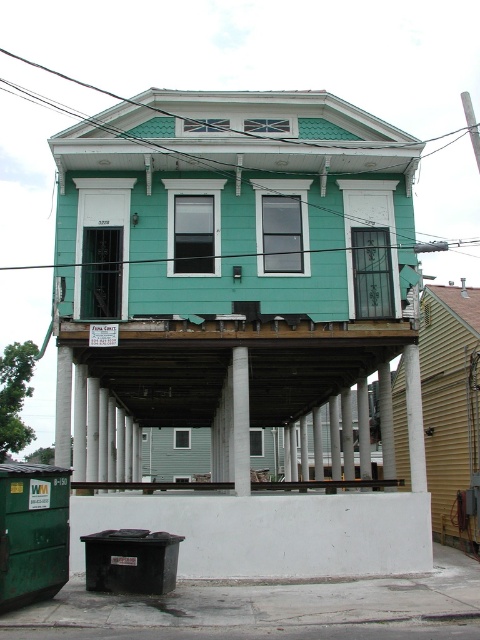
Question: Can you confirm if green matte dumpster at lower left is wider than metallic silver rail at lower center?

Choices:
 (A) no
 (B) yes

Answer: (A)

Question: Is green matte dumpster at lower left in front of metallic silver rail at lower center?

Choices:
 (A) no
 (B) yes

Answer: (B)

Question: Is green matte dumpster at lower left positioned behind metallic silver rail at lower center?

Choices:
 (A) yes
 (B) no

Answer: (B)

Question: Which point is farther to the camera?

Choices:
 (A) (16, 529)
 (B) (368, 483)

Answer: (B)